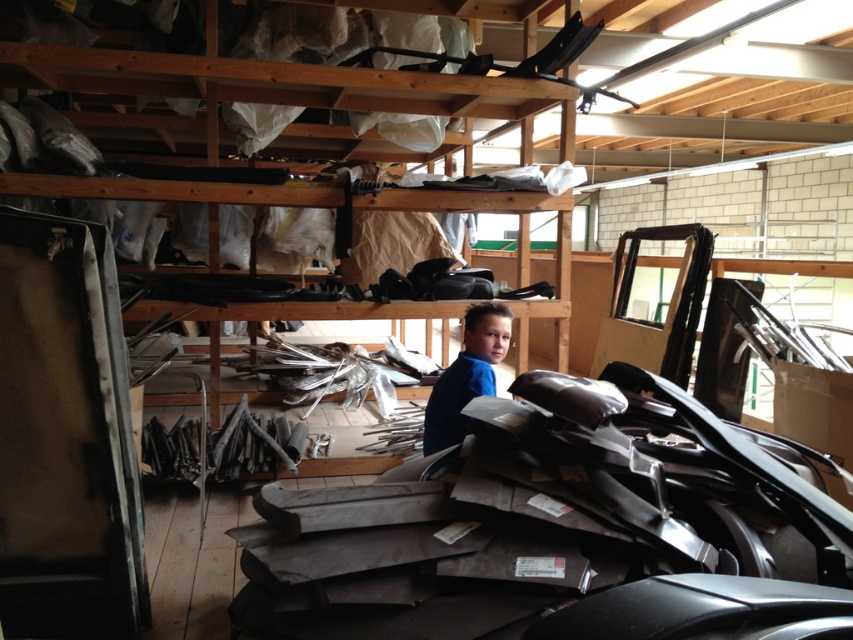
Which is more to the right, wooden shelves at center or blue matte shirt at center?

From the viewer's perspective, blue matte shirt at center appears more on the right side.

Who is higher up, wooden shelves at center or blue matte shirt at center?

wooden shelves at center is higher up.

Which is in front, point (437, 77) or point (434, 410)?

Positioned in front is point (434, 410).

This screenshot has width=853, height=640. Identify the location of wooden shelves at center. (395, 92).